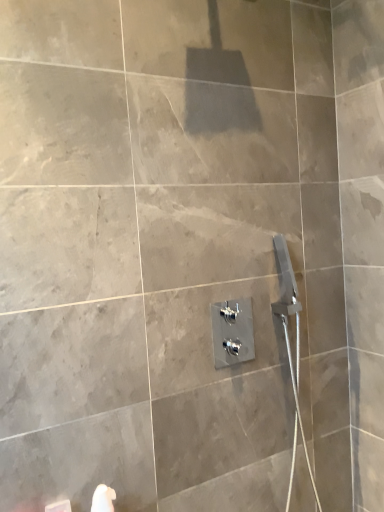
You are a GUI agent. You are given a task and a screenshot of the screen. Output one action in this format:
    pyautogui.click(x=<x>, y=<y>)
    Task: Click on the satin nickel shower at right
    Image resolution: width=384 pixels, height=512 pixels.
    Given the screenshot: What is the action you would take?
    pyautogui.click(x=289, y=343)

What do you see at coordinates (289, 343) in the screenshot?
I see `satin nickel shower at right` at bounding box center [289, 343].

Consider the image. What is the approximate width of satin nickel shower at right?

The width of satin nickel shower at right is 4.78 inches.

The width and height of the screenshot is (384, 512). Identify the location of satin nickel shower at right. (289, 343).